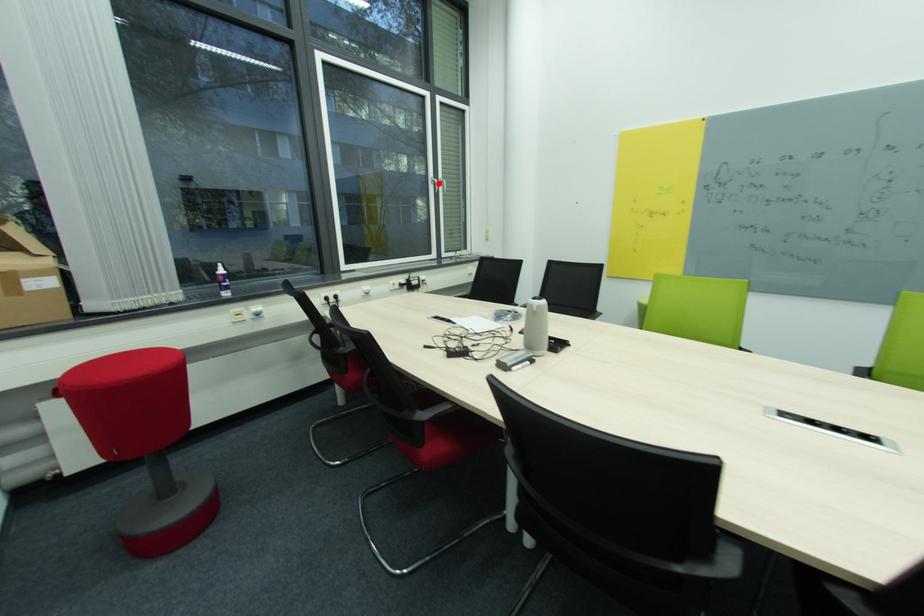
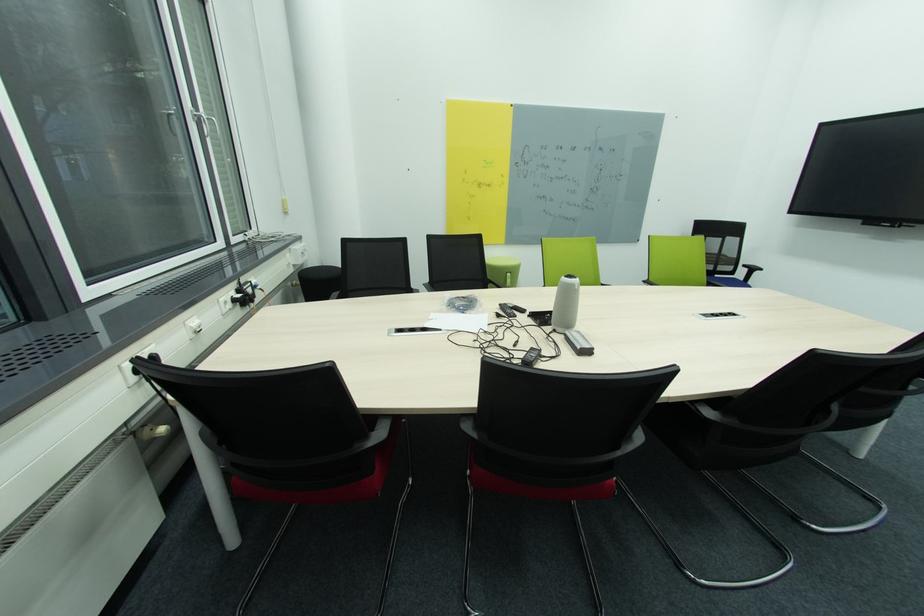
Locate, in the second image, the point that corresponds to the highlighted location in the first image.

(201, 120)